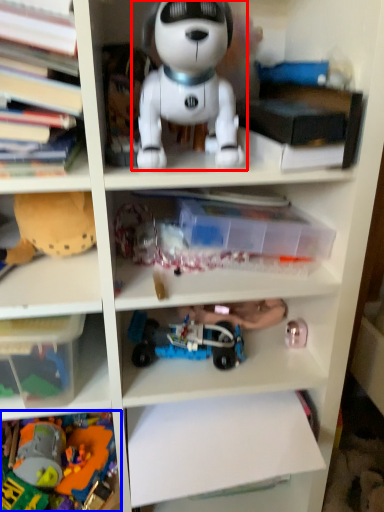
Question: Which object appears farthest to the camera in this image, toy (highlighted by a red box) or toy (highlighted by a blue box)?

Choices:
 (A) toy
 (B) toy

Answer: (B)